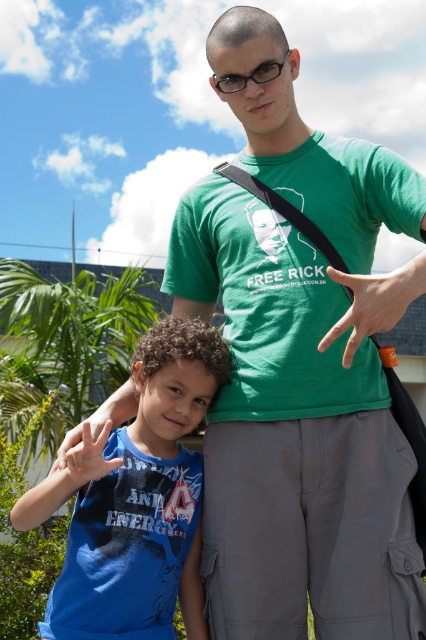
Question: Does blue cotton shirt at lower left have a greater width compared to matte blue t-shirt at lower left?

Choices:
 (A) yes
 (B) no

Answer: (A)

Question: Is blue cotton shirt at lower left positioned behind matte blue t-shirt at lower left?

Choices:
 (A) yes
 (B) no

Answer: (A)

Question: Which point is closer to the camera?

Choices:
 (A) (149, 595)
 (B) (379, 298)

Answer: (B)

Question: Which point appears farthest from the camera in this image?

Choices:
 (A) (129, 502)
 (B) (92, 438)
 (C) (356, 308)

Answer: (A)

Question: Which object is the closest to the matte blue t-shirt at lower left?

Choices:
 (A) blue cotton shirt at lower left
 (B) orange rubber band at center

Answer: (A)

Question: Observing the image, what is the correct spatial positioning of orange rubber band at center in reference to matte blue t-shirt at lower left?

Choices:
 (A) left
 (B) right

Answer: (B)